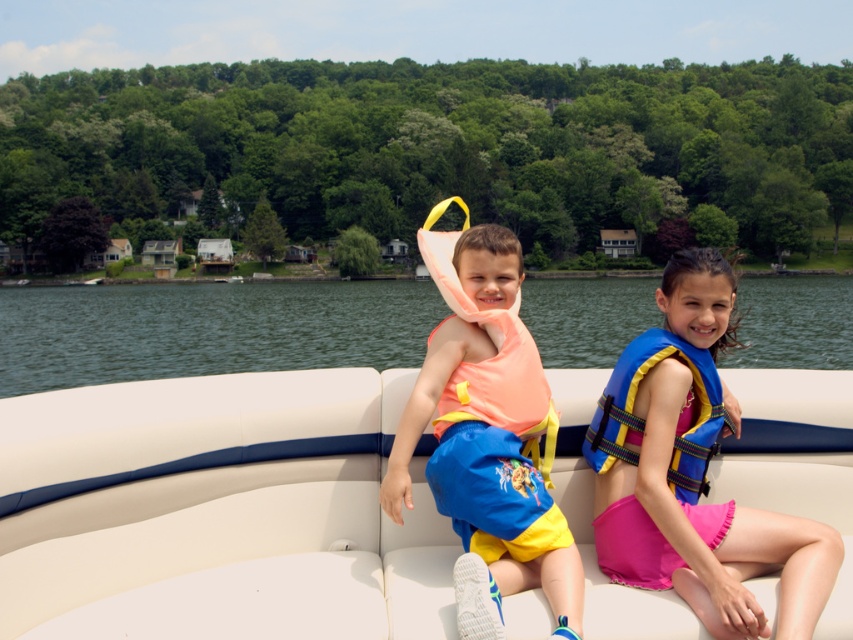
Question: Does clear blue water at center come in front of matte orange life vest at center?

Choices:
 (A) no
 (B) yes

Answer: (A)

Question: Among these objects, which one is nearest to the camera?

Choices:
 (A) blue/yellow striped life jacket at right
 (B) white vinyl boat at center
 (C) blue fabric life vest at center

Answer: (B)

Question: Based on their relative distances, which object is nearer to the white vinyl boat at center?

Choices:
 (A) blue fabric life vest at center
 (B) matte orange life vest at center
 (C) clear blue water at center

Answer: (B)

Question: Is clear blue water at center thinner than blue fabric life vest at center?

Choices:
 (A) yes
 (B) no

Answer: (B)

Question: Is clear blue water at center to the left of blue/yellow striped life jacket at right from the viewer's perspective?

Choices:
 (A) no
 (B) yes

Answer: (A)

Question: Estimate the real-world distances between objects in this image. Which object is closer to the matte orange life vest at center?

Choices:
 (A) white vinyl boat at center
 (B) clear blue water at center
 (C) blue fabric life vest at center
 (D) blue/yellow striped life jacket at right

Answer: (D)